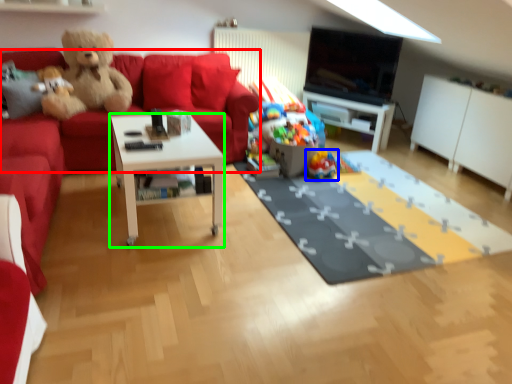
Question: Which object is the farthest from couch (highlighted by a red box)? Choose among these: toy (highlighted by a blue box) or coffee table (highlighted by a green box).

Choices:
 (A) toy
 (B) coffee table

Answer: (B)